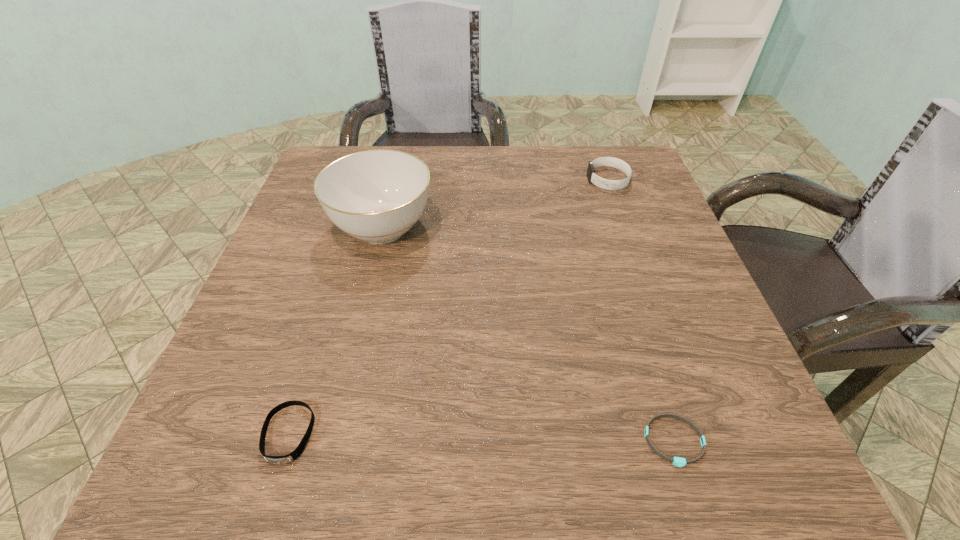
Where is `free space between the tallest object and the shortest wristband`? free space between the tallest object and the shortest wristband is located at coordinates (528, 335).

Image resolution: width=960 pixels, height=540 pixels. Identify the location of free space between the third nearest object and the shortest wristband. (528, 335).

Locate an element on the screen. free space between the shortest object and the chinaware is located at coordinates (528, 335).

Locate an element on the screen. The width and height of the screenshot is (960, 540). free space between the third nearest object and the second shortest object is located at coordinates (336, 331).

Choose which object is the nearest neighbor to the tallest object. Please provide its 2D coordinates. Your answer should be formatted as a tuple, i.e. [(x, y)], where the tuple contains the x and y coordinates of a point satisfying the conditions above.

[(278, 460)]

This screenshot has width=960, height=540. I want to click on object that stands as the closest to the second farthest object, so click(278, 460).

Find the location of a particular element. This screenshot has width=960, height=540. the second closest wristband relative to the farthest wristband is located at coordinates (278, 460).

Point out which wristband is positioned as the second nearest to the second farthest object. Please provide its 2D coordinates. Your answer should be formatted as a tuple, i.e. [(x, y)], where the tuple contains the x and y coordinates of a point satisfying the conditions above.

[(603, 183)]

Where is `vacant space that satisfies the following two spatial constraints: 1. on the outer surface of the farthest wristband; 2. on the display of the second tallest wristband`? vacant space that satisfies the following two spatial constraints: 1. on the outer surface of the farthest wristband; 2. on the display of the second tallest wristband is located at coordinates (699, 434).

You are a GUI agent. You are given a task and a screenshot of the screen. Output one action in this format:
    pyautogui.click(x=<x>, y=<y>)
    Task: Click on the vacant space that satisfies the following two spatial constraints: 1. on the outer surface of the tallest wristband; 2. on the display of the leftmost wristband
    
    Given the screenshot: What is the action you would take?
    pyautogui.click(x=699, y=434)